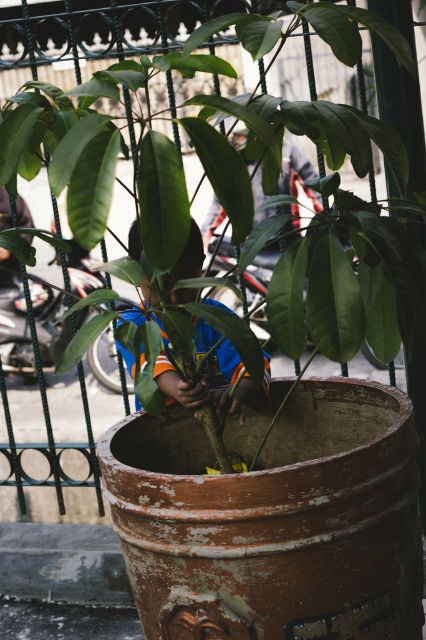
Is green matte pot at center bigger than blue jersey at center?

Yes.

Is green matte pot at center above blue jersey at center?

Indeed, green matte pot at center is positioned over blue jersey at center.

Identify the location of green matte pot at center. This screenshot has width=426, height=640. (196, 136).

The height and width of the screenshot is (640, 426). Identify the location of green matte pot at center. (x=196, y=136).